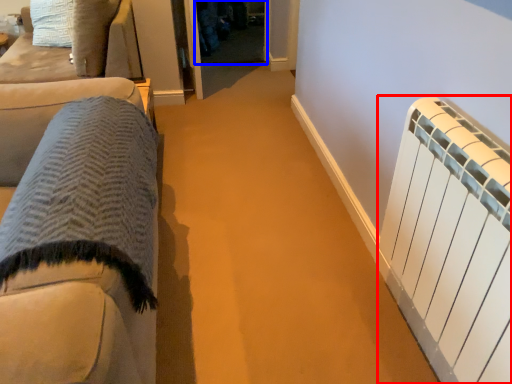
Question: Which point is further to the camera, radiator (highlighted by a red box) or glass door (highlighted by a blue box)?

Choices:
 (A) radiator
 (B) glass door

Answer: (B)